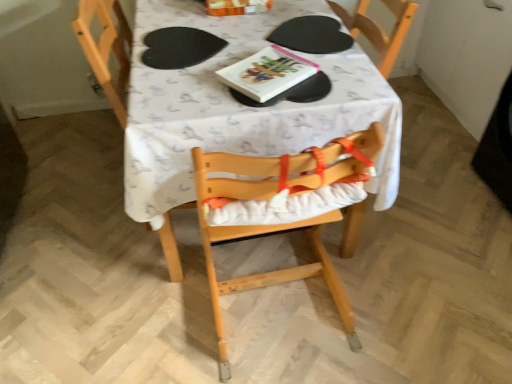
I want to click on vacant space that is to the left of hardcover book at center, so click(197, 86).